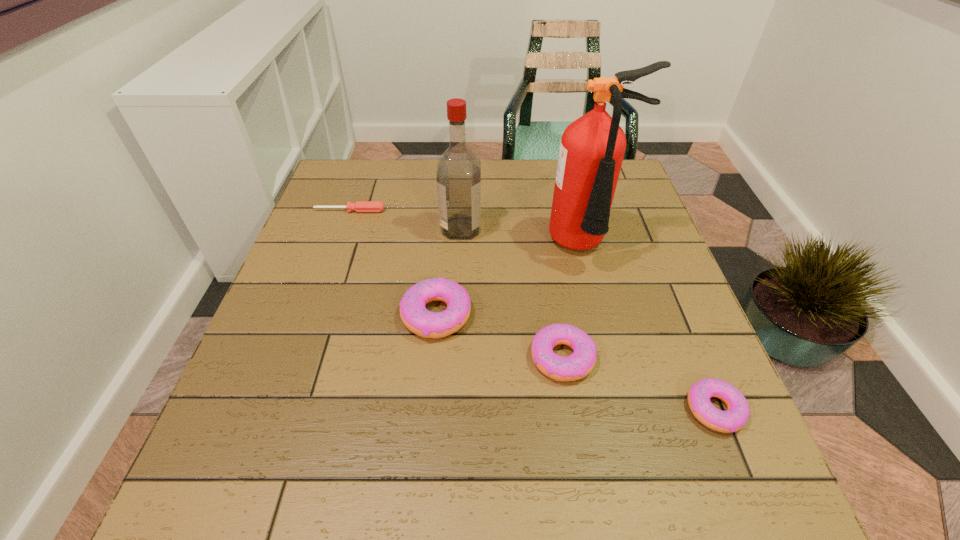
In the current image, all doughnuts are evenly spaced. To maintain this equal spacing, where should an additional doughnut be placed on the left? Please point out a free spot. Please provide its 2D coordinates. Your answer should be formatted as a tuple, i.e. [(x, y)], where the tuple contains the x and y coordinates of a point satisfying the conditions above.

[(328, 278)]